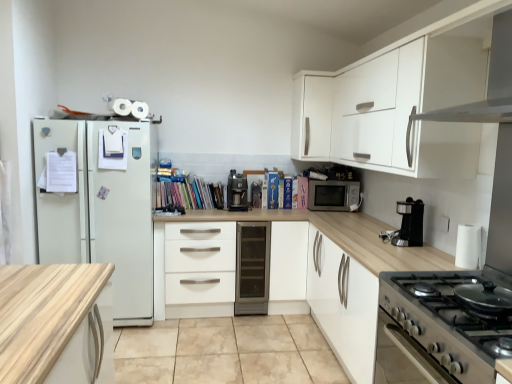
Locate an element on the screen. beige tile at center is located at coordinates (226, 352).

Measure the distance between white matte cabinet at upper right and camera.

12.35 feet.

The image size is (512, 384). I want to click on white glossy exhaust hood at upper right, so [488, 84].

What do you see at coordinates (252, 268) in the screenshot? I see `satin silver wine cooler at center` at bounding box center [252, 268].

Locate an element on the screen. This screenshot has height=384, width=512. beige matte oven at lower right is located at coordinates (404, 357).

Does point (503, 72) appear closer or farther from the camera than point (159, 327)?

Point (503, 72).

Is white glossy exhaust hood at upper right completely or partially outside of beige tile at center?

white glossy exhaust hood at upper right lies outside beige tile at center's area.

Is beige tile at center at the back of white glossy exhaust hood at upper right?

No, white glossy exhaust hood at upper right's orientation is not away from beige tile at center.

How many degrees apart are the facing directions of beige tile at center and white matte cabinet at upper right?

They differ by 179 degrees in their facing directions.

Is beige tile at center aimed at white matte cabinet at upper right?

No, beige tile at center is not turned towards white matte cabinet at upper right.

From the picture: Can you confirm if beige tile at center is shorter than white matte cabinet at upper right?

Yes.

Which object is thinner, beige tile at center or white matte cabinet at upper right?

white matte cabinet at upper right.

How distant is stainless steel gas stove at lower right from beige matte oven at lower right?

17.13 centimeters.

Between stainless steel gas stove at lower right and beige matte oven at lower right, which one has smaller width?

Thinner between the two is stainless steel gas stove at lower right.

How many degrees apart are the facing directions of stainless steel gas stove at lower right and beige matte oven at lower right?

The facing directions of stainless steel gas stove at lower right and beige matte oven at lower right are 0.000139 degrees apart.

Is stainless steel gas stove at lower right positioned far away from beige matte oven at lower right?

No, stainless steel gas stove at lower right is not far from beige matte oven at lower right.

Would you say white matte drawer at center is outside stainless steel gas stove at lower right?

Indeed, white matte drawer at center is completely outside stainless steel gas stove at lower right.

From the image's perspective, between white matte drawer at center and stainless steel gas stove at lower right, which one is located above?

stainless steel gas stove at lower right, from the image's perspective.

From a real-world perspective, is white matte drawer at center on stainless steel gas stove at lower right?

No, from a real-world perspective, white matte drawer at center is not above stainless steel gas stove at lower right.

From the picture: Who is more distant, white matte drawer at center or stainless steel gas stove at lower right?

white matte drawer at center is further from the camera.

Does white matte cabinet at upper right have a smaller size compared to metallic coffee maker at center?

Actually, white matte cabinet at upper right might be larger than metallic coffee maker at center.

Is white matte cabinet at upper right turned away from metallic coffee maker at center?

white matte cabinet at upper right does not have its back to metallic coffee maker at center.

Are white matte cabinet at upper right and metallic coffee maker at center located far from each other?

white matte cabinet at upper right is actually quite close to metallic coffee maker at center.

Can you tell me how much white matte cabinet at upper right and metallic coffee maker at center differ in facing direction?

They differ by 2.51 degrees in their facing directions.

The image size is (512, 384). There is a beige matte oven at lower right. What are the coordinates of `exhaust hood above it (from a real-world perspective)` in the screenshot? It's located at (x=488, y=84).

In terms of height, does white glossy exhaust hood at upper right look taller or shorter compared to beige matte oven at lower right?

Considering their sizes, white glossy exhaust hood at upper right has less height than beige matte oven at lower right.

Which of these two, white glossy exhaust hood at upper right or beige matte oven at lower right, is smaller?

white glossy exhaust hood at upper right.

Is white glossy exhaust hood at upper right located outside beige matte oven at lower right?

Yes, white glossy exhaust hood at upper right is outside of beige matte oven at lower right.

Looking at this image, is metallic coffee maker at center wider than white matte cabinet at upper right?

No, metallic coffee maker at center is not wider than white matte cabinet at upper right.

Are metallic coffee maker at center and white matte cabinet at upper right beside each other?

No, metallic coffee maker at center is not next to white matte cabinet at upper right.

From the image's perspective, is metallic coffee maker at center above white matte cabinet at upper right?

Incorrect, from the image's perspective, metallic coffee maker at center is lower than white matte cabinet at upper right.

The height and width of the screenshot is (384, 512). Identify the location of tile below the white glossy exhaust hood at upper right (from the image's perspective). (226, 352).

What are the coordinates of `tile located on the left of white matte cabinet at upper right` in the screenshot? It's located at (226, 352).

Which object lies further to the anchor point satin silver microwave at center, white matte drawer at center or white glossy exhaust hood at upper right?

white glossy exhaust hood at upper right.

Which object lies nearer to the anchor point metallic coffee maker at center, satin silver microwave at center or beige matte oven at lower right?

satin silver microwave at center is positioned closer to the anchor metallic coffee maker at center.

When comparing their distances from beige tile at center, does satin silver wine cooler at center or satin silver microwave at center seem closer?

Among the two, satin silver wine cooler at center is located nearer to beige tile at center.

Estimate the real-world distances between objects in this image. Which object is closer to white matte drawer at center, satin silver wine cooler at center or satin silver microwave at center?

satin silver wine cooler at center.

Which object lies nearer to the anchor point satin silver microwave at center, white glossy exhaust hood at upper right or satin black coffee machine at center?

satin black coffee machine at center lies closer to satin silver microwave at center than the other object.

Estimate the real-world distances between objects in this image. Which object is further from beige matte oven at lower right, metallic coffee maker at center or white matte drawer at center?

metallic coffee maker at center is further to beige matte oven at lower right.

Looking at the image, which one is located further to metallic coffee maker at center, white matte cabinet at upper right or satin black coffee machine at center?

white matte cabinet at upper right is further to metallic coffee maker at center.

Considering their positions, is beige tile at center positioned further to satin black coffee machine at center than white matte cabinet at upper right?

beige tile at center.

I want to click on cabinetry between stainless steel gas stove at lower right and satin silver microwave at center along the z-axis, so click(312, 115).

Where is `tile between stainless steel gas stove at lower right and satin silver microwave at center from front to back`? Image resolution: width=512 pixels, height=384 pixels. tile between stainless steel gas stove at lower right and satin silver microwave at center from front to back is located at coordinates (226, 352).

What are the coordinates of `drawer positioned between beige matte oven at lower right and metallic coffee maker at center from near to far` in the screenshot? It's located at (199, 263).

You are a GUI agent. You are given a task and a screenshot of the screen. Output one action in this format:
    pyautogui.click(x=<x>, y=<y>)
    Task: Click on the gas stove positioned between white glossy exhaust hood at upper right and white matte drawer at center from near to far
    
    Given the screenshot: What is the action you would take?
    pyautogui.click(x=456, y=310)